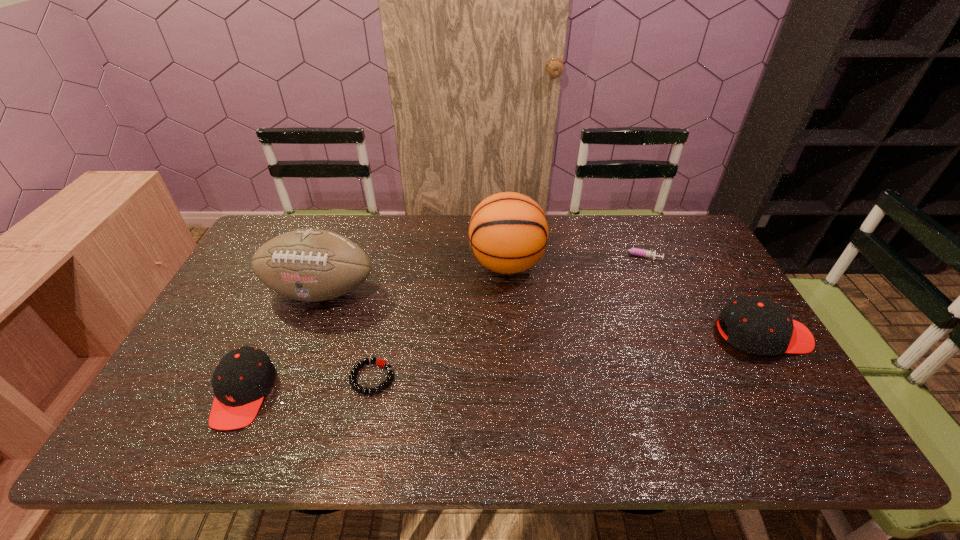
Locate an element on the screen. The image size is (960, 540). the left cap is located at coordinates (243, 376).

Locate an element on the screen. The image size is (960, 540). the shorter cap is located at coordinates (243, 376).

The height and width of the screenshot is (540, 960). In order to click on the right cap in this screenshot , I will do `click(757, 325)`.

The width and height of the screenshot is (960, 540). I want to click on the rightmost object, so click(757, 325).

Where is `the second shortest object`? This screenshot has height=540, width=960. the second shortest object is located at coordinates (634, 251).

At what (x,y) coordinates should I click in order to perform the action: click on the second object from right to left. Please return your answer as a coordinate pair (x, y). Image resolution: width=960 pixels, height=540 pixels. Looking at the image, I should click on (634, 251).

You are a GUI agent. You are given a task and a screenshot of the screen. Output one action in this format:
    pyautogui.click(x=<x>, y=<y>)
    Task: Click on the third object from right to left
    
    Given the screenshot: What is the action you would take?
    pyautogui.click(x=508, y=232)

Identify the location of the tallest object. (508, 232).

Locate an element on the screen. This screenshot has height=540, width=960. the fifth shortest object is located at coordinates (311, 265).

Where is `the shortest object`? The height and width of the screenshot is (540, 960). the shortest object is located at coordinates (380, 362).